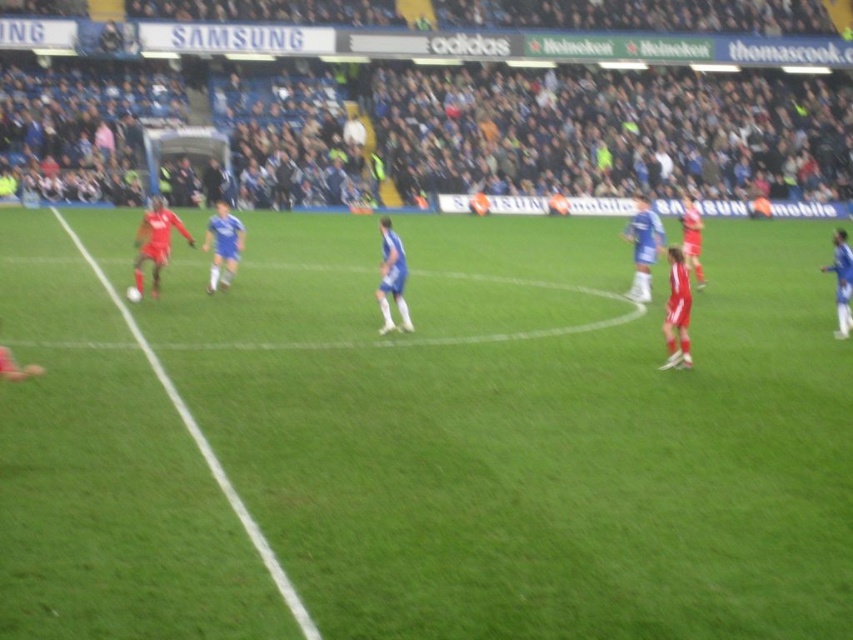
Question: Based on their relative distances, which object is farther from the blue jersey at center?

Choices:
 (A) red jersey soccer player at left
 (B) green grass at left
 (C) green grass field at center

Answer: (B)

Question: Which object appears farthest from the camera in this image?

Choices:
 (A) blue jersey at center
 (B) green grass at left
 (C) green grass field at center
 (D) red jersey soccer player at left

Answer: (A)

Question: Is green grass field at center to the left of blue jersey at center from the viewer's perspective?

Choices:
 (A) no
 (B) yes

Answer: (A)

Question: Is red jersey soccer player at left wider than blue jersey at center?

Choices:
 (A) yes
 (B) no

Answer: (A)

Question: Is green grass field at center wider than blue jersey at center?

Choices:
 (A) yes
 (B) no

Answer: (A)

Question: Which object is the farthest from the blue jersey at center?

Choices:
 (A) red jersey soccer player at left
 (B) green grass at left

Answer: (B)